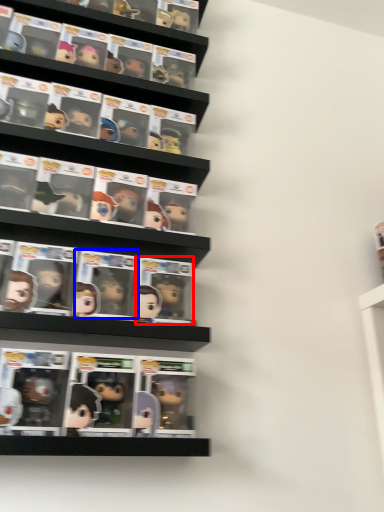
Question: Which point is closer to the camera, comic book (highlighted by a red box) or comic book (highlighted by a blue box)?

Choices:
 (A) comic book
 (B) comic book

Answer: (B)